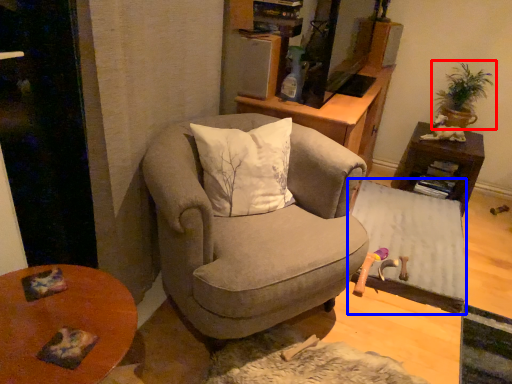
Question: Which point is closer to the camera, houseplant (highlighted by a red box) or table (highlighted by a blue box)?

Choices:
 (A) houseplant
 (B) table

Answer: (B)